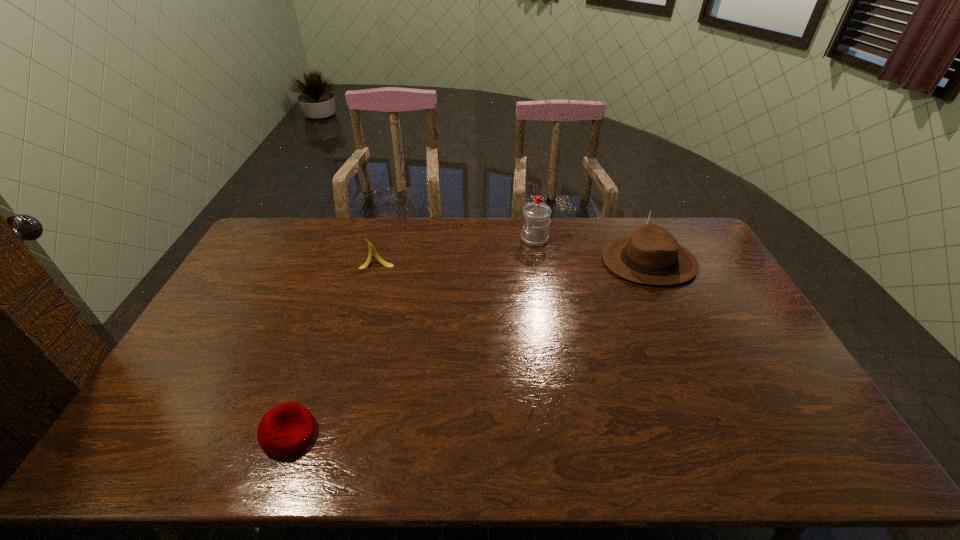
This screenshot has height=540, width=960. In order to click on unoccupied position between the third shortest object and the nearest object in this screenshot , I will do `click(468, 348)`.

The width and height of the screenshot is (960, 540). What are the coordinates of `unoccupied position between the beanbag and the fedora` in the screenshot? It's located at (468, 348).

At what (x,y) coordinates should I click in order to perform the action: click on vacant space that's between the third object from left to right and the second shortest object. Please return your answer as a coordinate pair (x, y). The image size is (960, 540). Looking at the image, I should click on (456, 249).

At what (x,y) coordinates should I click in order to perform the action: click on free space that is in between the banana and the third shortest object. Please return your answer as a coordinate pair (x, y). The height and width of the screenshot is (540, 960). Looking at the image, I should click on (513, 261).

Locate an element on the screen. Image resolution: width=960 pixels, height=540 pixels. vacant region between the second object from right to left and the rightmost object is located at coordinates (591, 251).

The width and height of the screenshot is (960, 540). In order to click on object that stands as the closest to the nearest object in this screenshot , I will do `click(372, 251)`.

Locate an element on the screen. the third closest object to the banana is located at coordinates (651, 255).

In order to click on free spot that satisfies the following two spatial constraints: 1. on the handle side of the second object from right to left; 2. on the front side of the second shortest object in this screenshot , I will do (x=538, y=260).